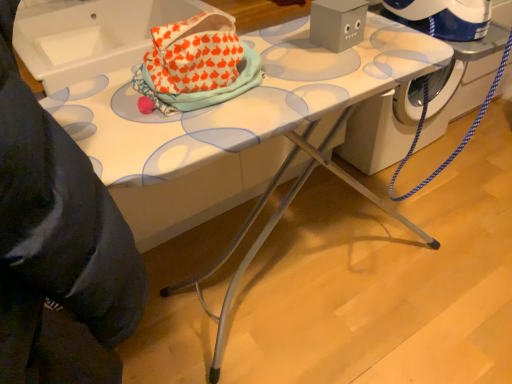
Question: Is white ceramic sink at upper left facing towards white plastic washing machine at center?

Choices:
 (A) yes
 (B) no

Answer: (B)

Question: Does white ceramic sink at upper left have a greater width compared to white plastic washing machine at center?

Choices:
 (A) no
 (B) yes

Answer: (B)

Question: Is white ceramic sink at upper left at the right side of white plastic washing machine at center?

Choices:
 (A) no
 (B) yes

Answer: (A)

Question: Is white ceramic sink at upper left thinner than white plastic washing machine at center?

Choices:
 (A) no
 (B) yes

Answer: (A)

Question: Does white ceramic sink at upper left have a smaller size compared to white plastic washing machine at center?

Choices:
 (A) no
 (B) yes

Answer: (B)

Question: Is the position of white ceramic sink at upper left more distant than that of white plastic washing machine at center?

Choices:
 (A) yes
 (B) no

Answer: (B)

Question: Is white plastic washing machine at center looking in the opposite direction of white ceramic sink at upper left?

Choices:
 (A) no
 (B) yes

Answer: (A)

Question: From a real-world perspective, is white plastic washing machine at center on white ceramic sink at upper left?

Choices:
 (A) no
 (B) yes

Answer: (A)

Question: From the image's perspective, is white plastic washing machine at center above white ceramic sink at upper left?

Choices:
 (A) yes
 (B) no

Answer: (B)

Question: Considering the relative positions of white plastic washing machine at center and white ceramic sink at upper left in the image provided, is white plastic washing machine at center to the right of white ceramic sink at upper left from the viewer's perspective?

Choices:
 (A) yes
 (B) no

Answer: (A)

Question: Can you confirm if white plastic washing machine at center is thinner than white ceramic sink at upper left?

Choices:
 (A) yes
 (B) no

Answer: (A)

Question: Is white plastic washing machine at center positioned beyond the bounds of white ceramic sink at upper left?

Choices:
 (A) no
 (B) yes

Answer: (B)

Question: Relative to white ceramic sink at upper left, is white plastic washing machine at center in front or behind?

Choices:
 (A) behind
 (B) front

Answer: (A)